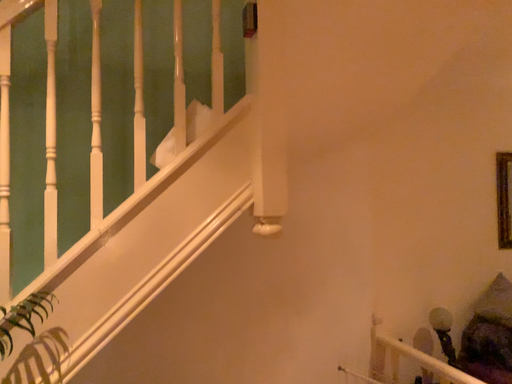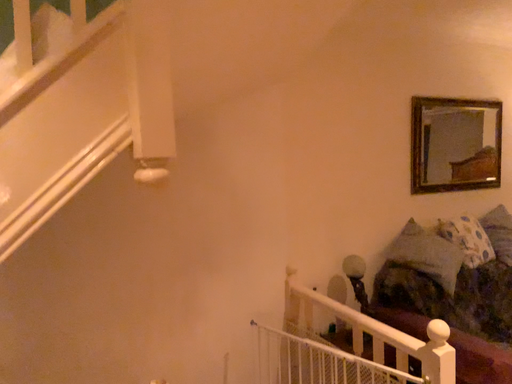
Question: Which way did the camera rotate in the video?

Choices:
 (A) rotated left
 (B) rotated right

Answer: (B)